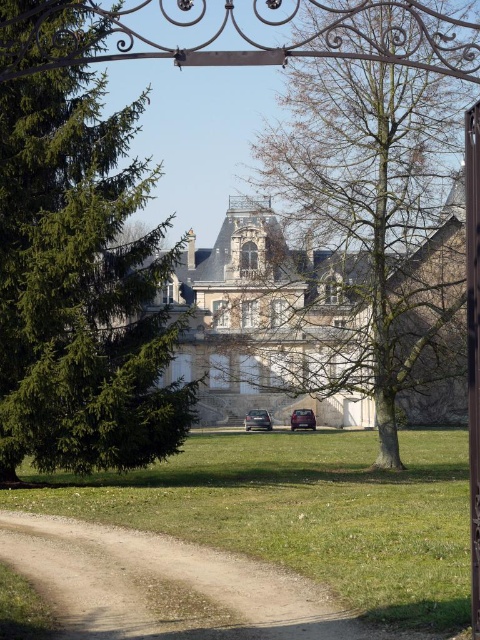
You are standing at the entrance of the historic building and want to park your car. The parking spot you desire is at coordinates point 0.658, 0.537. Is the matte black car at center currently occupying this spot?

The matte black car at center is located at point [257,420], so yes, it is occupying the desired parking spot.

You are standing at the entrance of the building and see the point marked at coordinate (364, 173). What does this point indicate?

The point at coordinate (364, 173) marks the location of the bare wood tree at center.